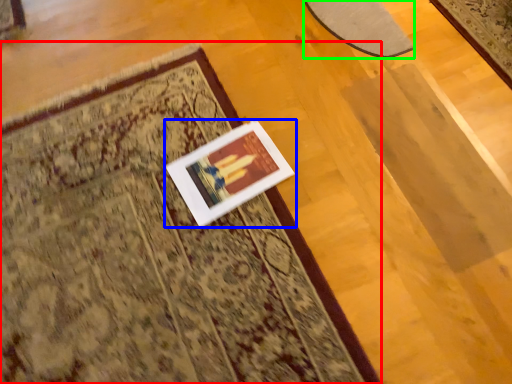
Question: Considering the real-world distances, which object is farthest from mat (highlighted by a red box)? picture frame (highlighted by a blue box) or mat (highlighted by a green box)?

Choices:
 (A) picture frame
 (B) mat

Answer: (B)